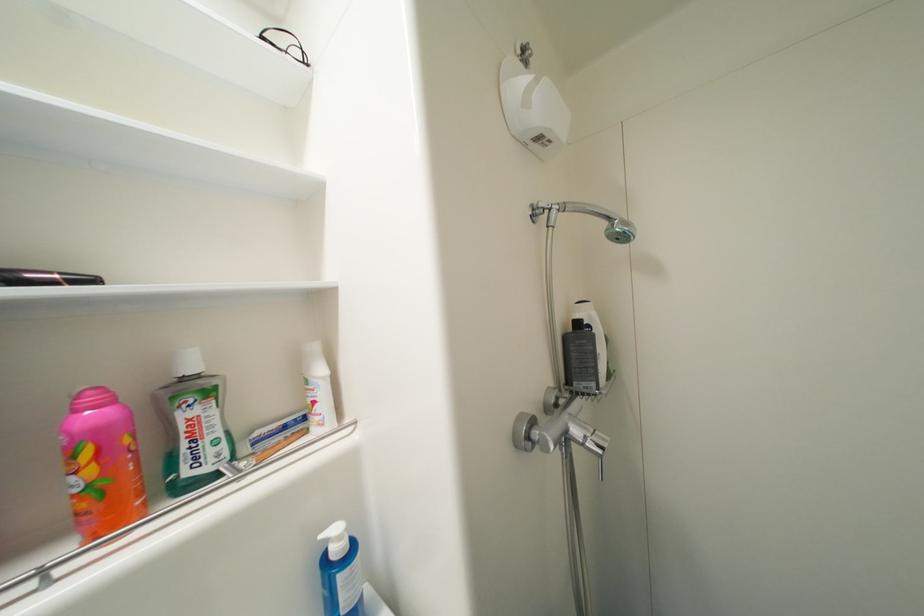
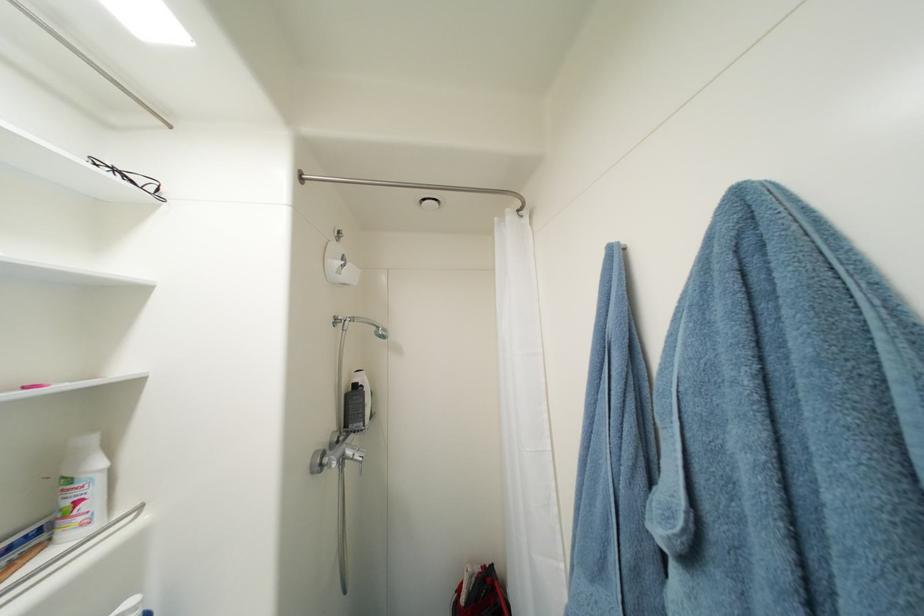
Find the pixel in the second image that matches point 582,434 in the first image.

(356, 454)